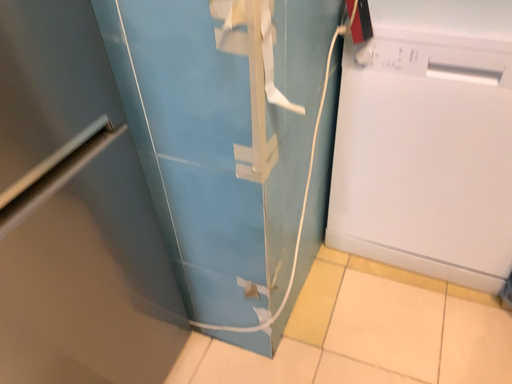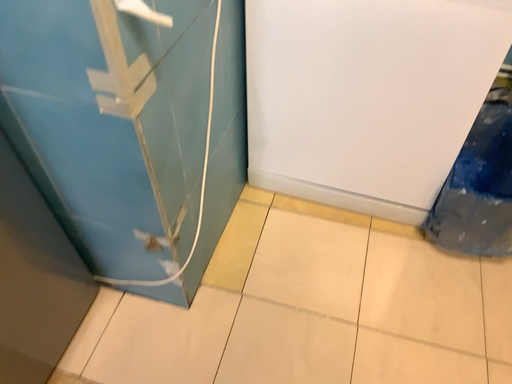
Question: How did the camera likely rotate when shooting the video?

Choices:
 (A) rotated left
 (B) rotated right

Answer: (B)